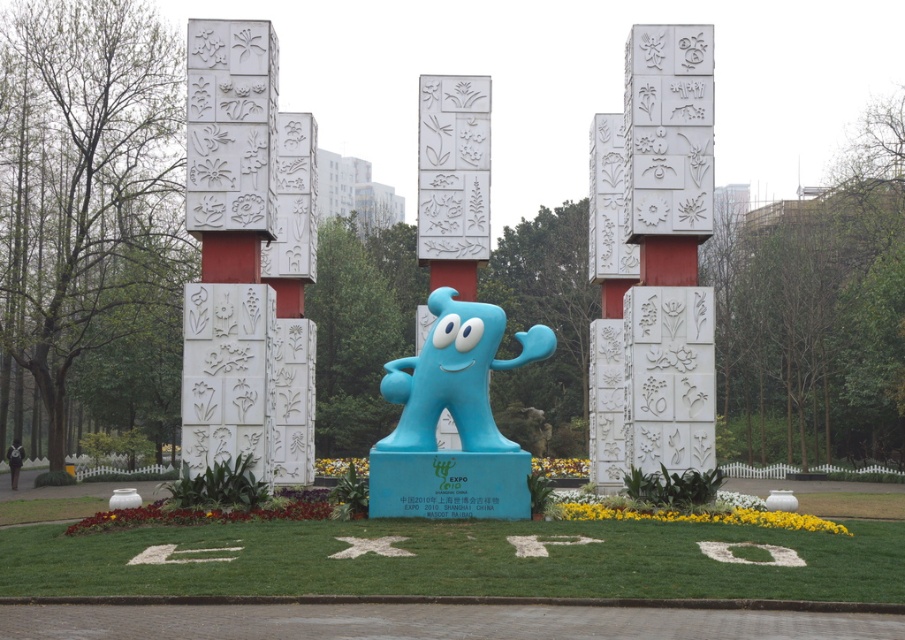
You are a landscape architect designing a new garden layout. You have to place both the blue rubber statue at center and the white stone pillars at center in an area where space is limited. Based on the scene description, which object should you prioritize placing first to ensure proper spacing?

The blue rubber statue at center occupies less space than the white stone pillars at center, so you should prioritize placing the white stone pillars at center first to ensure there is enough space for them.

You are standing at the base of the sculpture and want to walk to the point labeled point [169,536]. Which direction should you go relative to point [642,104]?

Since point [169,536] is in front of point [642,104], you should walk towards the direction of point [169,536], which is in front of point [642,104].

You are a visitor at the Shanghai World Expo 2010, standing in front of the blue rubber statue at center. You want to take a photo of the white textured stone pillar at left in the background. Can you do this without moving from your current position?

The blue rubber statue at center is located below the white textured stone pillar at left, so yes, you can take a photo of the white textured stone pillar at left in the background without moving from your current position because the pillar is above the statue in your view.